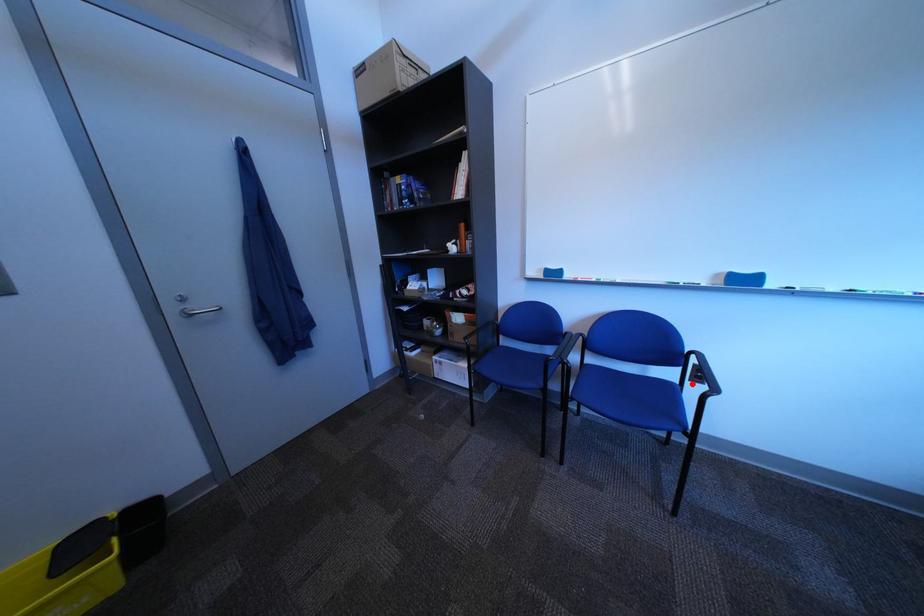
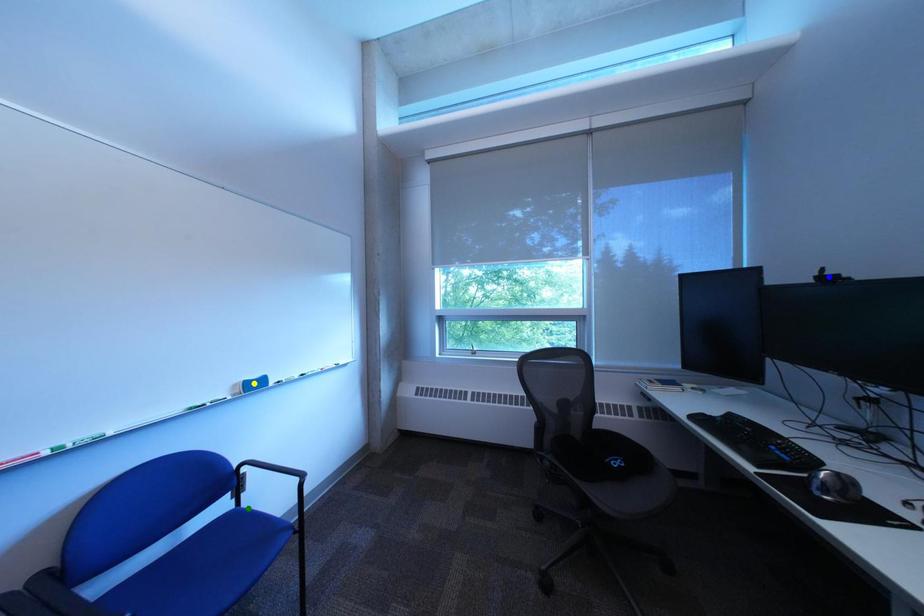
Question: I am providing you with two images of the same scene from different viewpoints. A red point is marked on the first image. You are given multiple points on the second image. In image 2, which mark is for the same physical point as the one in image 1?

Choices:
 (A) blue point
 (B) green point
 (C) yellow point

Answer: (B)